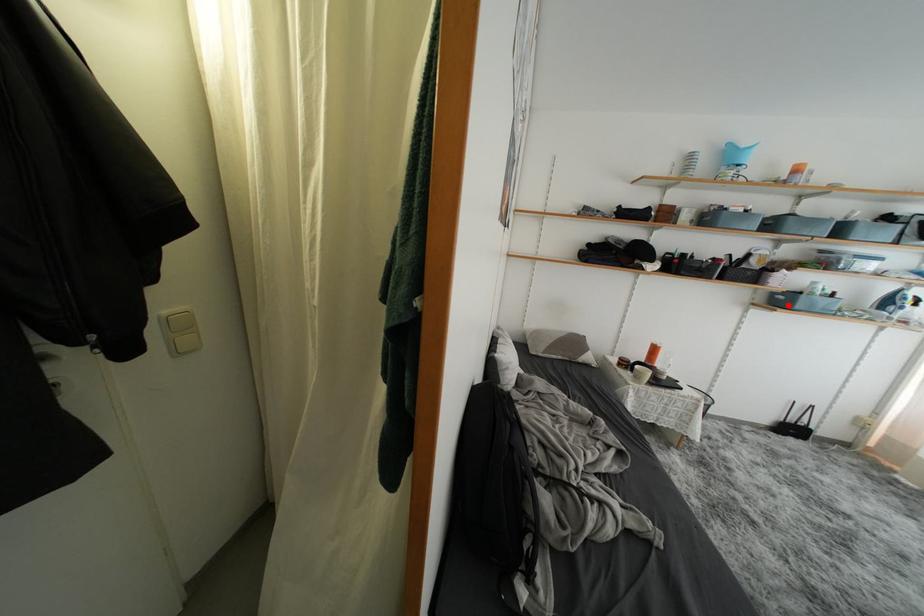
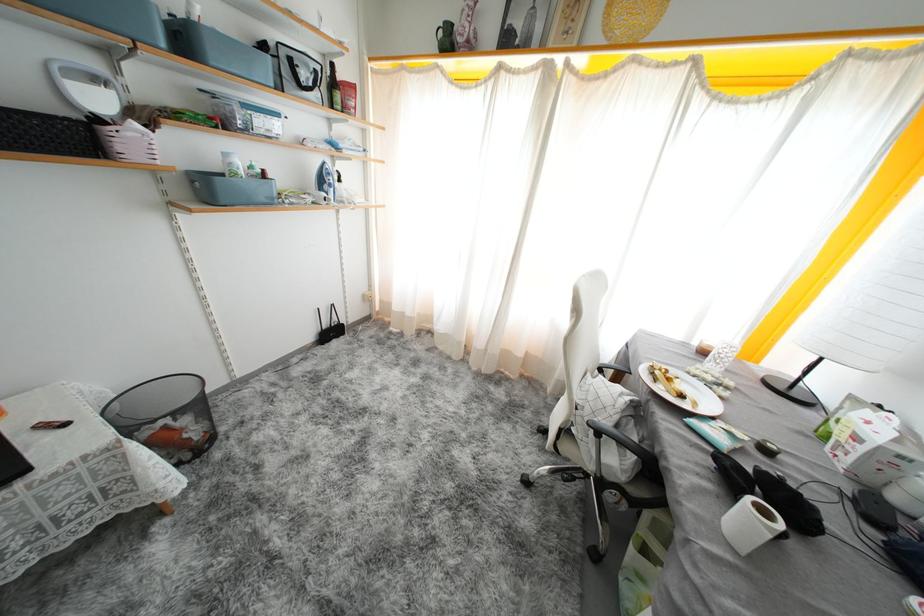
In the second image, find the point that corresponds to the highlighted location in the first image.

(215, 196)